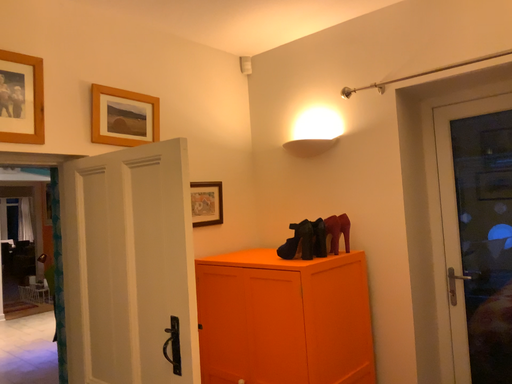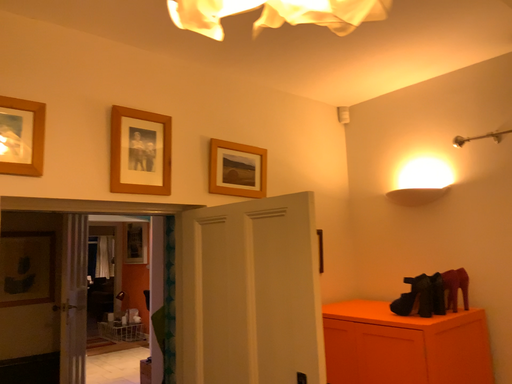
Question: How did the camera likely rotate when shooting the video?

Choices:
 (A) rotated right
 (B) rotated left

Answer: (B)